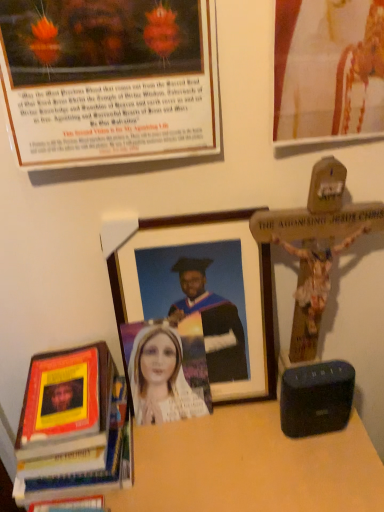
This screenshot has width=384, height=512. In order to click on free space in front of black plastic speaker at lower right in this screenshot , I will do `click(323, 474)`.